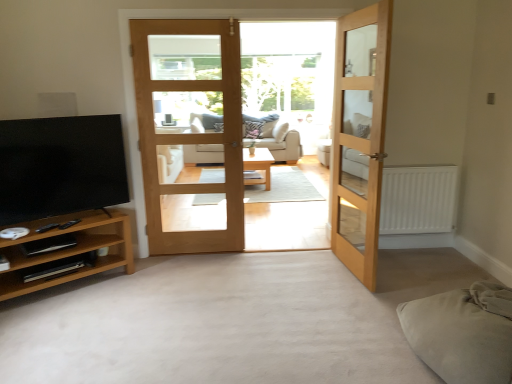
Where is `beige fabric studio couch at center`? beige fabric studio couch at center is located at coordinates (279, 141).

This screenshot has height=384, width=512. What do you see at coordinates (359, 137) in the screenshot?
I see `light brown wooden door at center, the 1th door positioned from the right` at bounding box center [359, 137].

Locate an element on the screen. This screenshot has height=384, width=512. beige fabric studio couch at center is located at coordinates (279, 141).

Between clear glass door at center and light wood/finished table at center, which one has smaller width?

clear glass door at center.

Is light wood/finished table at center surrounded by clear glass door at center?

Actually, light wood/finished table at center is outside clear glass door at center.

Considering the positions of objects clear glass door at center and light wood/finished table at center in the image provided, who is more to the left, clear glass door at center or light wood/finished table at center?

clear glass door at center.

Which object is more forward, clear glass door at center or light wood/finished table at center?

Positioned in front is clear glass door at center.

Is clear glass door at center completely or partially outside of matte black tv at left?

Yes, clear glass door at center is not within matte black tv at left.

Which is behind, clear glass door at center or matte black tv at left?

clear glass door at center.

How different are the orientations of clear glass door at center and matte black tv at left in degrees?

They differ by 37.3 degrees in their facing directions.

Where is `television beneath the clear glass door at center (from a real-world perspective)`? The height and width of the screenshot is (384, 512). television beneath the clear glass door at center (from a real-world perspective) is located at coordinates (60, 166).

Who is taller, brown wood tv stand at lower left or clear glass door at center?

clear glass door at center.

Which is behind, point (99, 263) or point (354, 40)?

The point (354, 40) is behind.

What's the angular difference between brown wood tv stand at lower left and clear glass door at center's facing directions?

37.3 degrees.

Identify the location of cabinetry beneath the clear glass door at center (from a real-world perspective). Image resolution: width=512 pixels, height=384 pixels. (69, 250).

What's the angular difference between light brown wooden door at center, the second door positioned from the left, and light wood/finished table at center's facing directions?

There is a 82.7-degree angle between the facing directions of light brown wooden door at center, the second door positioned from the left, and light wood/finished table at center.

Are light brown wooden door at center, the 1th door positioned from the right, and light wood/finished table at center making contact?

No, light brown wooden door at center, the 1th door positioned from the right, is not next to light wood/finished table at center.

Is light brown wooden door at center, the 1th door positioned from the right, facing away from light wood/finished table at center?

light brown wooden door at center, the 1th door positioned from the right, is not turned away from light wood/finished table at center.

From a real-world perspective, count 1st doors upward from the light wood/finished table at center and point to it. Please provide its 2D coordinates.

[(359, 137)]

From the image's perspective, does light wood/finished table at center appear lower than matte black tv at left?

Actually, light wood/finished table at center appears above matte black tv at left in the image.

From a real-world perspective, which object stands above the other?

From a 3D spatial view, matte black tv at left is above.

Is light wood/finished table at center not within matte black tv at left?

light wood/finished table at center is positioned outside matte black tv at left.

Considering their positions, is light wood/finished table at center located in front of or behind matte black tv at left?

Visually, light wood/finished table at center is located behind matte black tv at left.

From the picture: From a real-world perspective, relative to light wood/finished table at center, is beige fabric studio couch at center vertically above or below?

In terms of real-world spatial position, beige fabric studio couch at center is above light wood/finished table at center.

Between beige fabric studio couch at center and light wood/finished table at center, which one has larger width?

light wood/finished table at center is wider.

From the picture: Does beige fabric studio couch at center come behind light wood/finished table at center?

Yes, beige fabric studio couch at center is behind light wood/finished table at center.

In the scene shown: Can you confirm if beige fabric studio couch at center is shorter than light wood/finished table at center?

In fact, beige fabric studio couch at center may be taller than light wood/finished table at center.

Is light wood/finished table at center not within clear glass door at center?

light wood/finished table at center is positioned outside clear glass door at center.

How different are the orientations of light wood/finished table at center and clear glass door at center in degrees?

The angular difference between light wood/finished table at center and clear glass door at center is 0.000708 degrees.

Which is closer, (257, 157) or (374, 219)?

Point (257, 157) is positioned farther from the camera compared to point (374, 219).

Considering the relative positions of light wood/finished table at center and clear glass door at center in the image provided, is light wood/finished table at center to the left or to the right of clear glass door at center?

Based on their positions, light wood/finished table at center is located to the right of clear glass door at center.

Locate an element on the screen. The image size is (512, 384). screen door above the light wood/finished table at center (from a real-world perspective) is located at coordinates (360, 140).

In the image, there is a clear glass door at center. At what (x,y) coordinates should I click in order to perform the action: click on television below it (from a real-world perspective). Please return your answer as a coordinate pair (x, y). Image resolution: width=512 pixels, height=384 pixels. Looking at the image, I should click on (60, 166).

From the image, which object appears to be nearer to light brown wooden door at center, the 1th door positioned from the right, light oak wooden door at center, marked as the 1th door in a left-to-right arrangement, or matte black tv at left?

light oak wooden door at center, marked as the 1th door in a left-to-right arrangement, is positioned closer to the anchor light brown wooden door at center, the 1th door positioned from the right.

Considering their positions, is matte black tv at left positioned closer to light wood/finished table at center than light oak wooden door at center, marked as the 1th door in a left-to-right arrangement?

light oak wooden door at center, marked as the 1th door in a left-to-right arrangement, is positioned closer to the anchor light wood/finished table at center.

Looking at the image, which one is located further to light wood/finished table at center, light oak wooden door at center, the second door when ordered from right to left, or matte black tv at left?

matte black tv at left.

From the image, which object appears to be farther from brown wood tv stand at lower left, light wood/finished table at center or light oak wooden door at center, the second door when ordered from right to left?

The object further to brown wood tv stand at lower left is light wood/finished table at center.

Based on the photo, when comparing their distances from light wood/finished table at center, does light oak wooden door at center, marked as the 1th door in a left-to-right arrangement, or white matte radiator at right seem closer?

light oak wooden door at center, marked as the 1th door in a left-to-right arrangement, lies closer to light wood/finished table at center than the other object.

Consider the image. From the image, which object appears to be farther from light oak wooden door at center, the second door when ordered from right to left, beige fabric studio couch at center or white matte radiator at right?

The object further to light oak wooden door at center, the second door when ordered from right to left, is beige fabric studio couch at center.

Estimate the real-world distances between objects in this image. Which object is closer to clear glass door at center, light oak wooden door at center, marked as the 1th door in a left-to-right arrangement, or matte black tv at left?

The object closer to clear glass door at center is light oak wooden door at center, marked as the 1th door in a left-to-right arrangement.

Which object lies further to the anchor point matte black tv at left, light brown wooden door at center, the 1th door positioned from the right, or beige fabric studio couch at center?

beige fabric studio couch at center lies further to matte black tv at left than the other object.

Locate an element on the screen. The height and width of the screenshot is (384, 512). table between light brown wooden door at center, the 1th door positioned from the right, and beige fabric studio couch at center from front to back is located at coordinates (258, 165).

Locate an element on the screen. radiator positioned between light oak wooden door at center, the second door when ordered from right to left, and beige fabric studio couch at center from near to far is located at coordinates (418, 199).

This screenshot has width=512, height=384. Identify the location of door between brown wood tv stand at lower left and light brown wooden door at center, the second door positioned from the left. (190, 132).

What are the coordinates of `screen door between light brown wooden door at center, the second door positioned from the left, and light wood/finished table at center from front to back` in the screenshot? It's located at (360, 140).